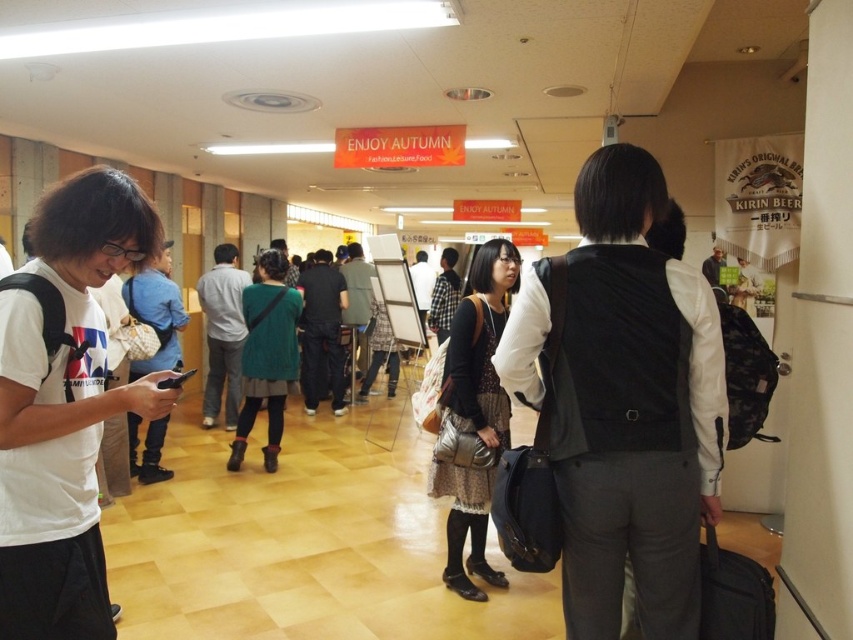
Question: Is black matte vest at center behind white matte t-shirt at left?

Choices:
 (A) no
 (B) yes

Answer: (B)

Question: Is black matte vest at center positioned at the back of white matte t-shirt at left?

Choices:
 (A) no
 (B) yes

Answer: (B)

Question: Is black matte vest at center to the left of white matte t-shirt at left from the viewer's perspective?

Choices:
 (A) no
 (B) yes

Answer: (A)

Question: Which object is farther from the camera taking this photo?

Choices:
 (A) black matte vest at center
 (B) white matte t-shirt at left

Answer: (A)

Question: Which object is farther from the camera taking this photo?

Choices:
 (A) black matte vest at center
 (B) white matte t-shirt at left

Answer: (A)